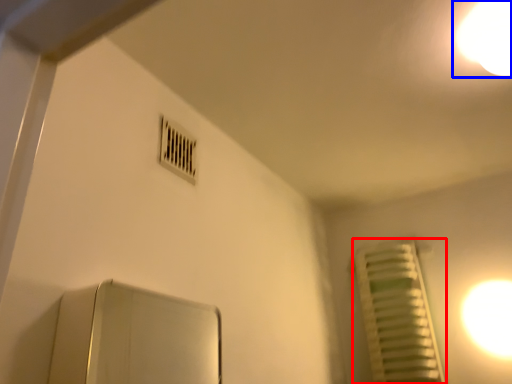
Question: Which object appears closest to the camera in this image, radiator (highlighted by a red box) or light (highlighted by a blue box)?

Choices:
 (A) radiator
 (B) light

Answer: (B)